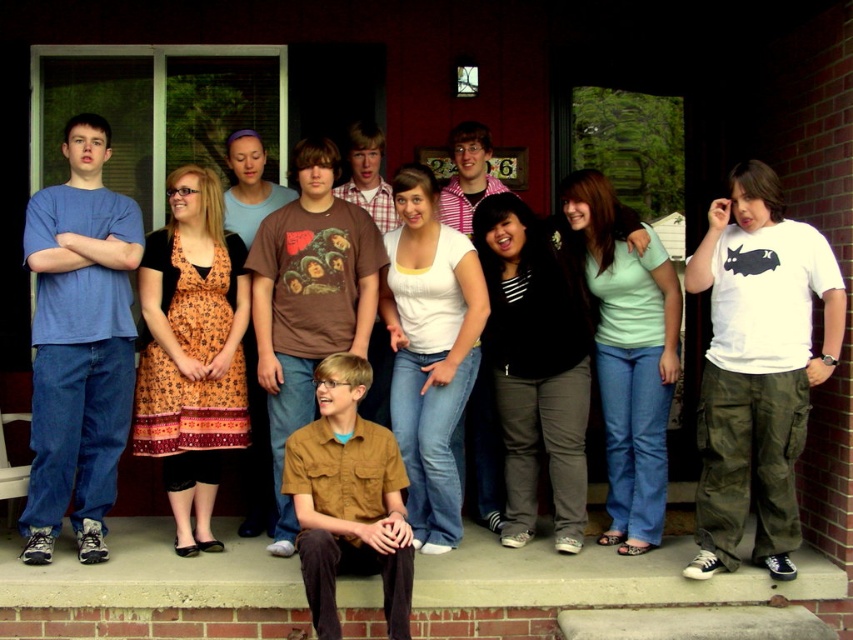
Question: Which object is positioned farthest from the matte blue t-shirt at left?

Choices:
 (A) brown cotton t-shirt at center
 (B) white matte t-shirt at center

Answer: (B)

Question: Which of the following is the closest to the observer?

Choices:
 (A) (827, 260)
 (B) (392, 564)
 (C) (271, 417)

Answer: (B)

Question: Among these objects, which one is farthest from the camera?

Choices:
 (A) matte blue t-shirt at left
 (B) white matte t-shirt at center

Answer: (A)

Question: Is matte blue t-shirt at left to the left of brown cotton t-shirt at center from the viewer's perspective?

Choices:
 (A) no
 (B) yes

Answer: (B)

Question: Is white matte t-shirt at center to the right of matte blue t-shirt at left from the viewer's perspective?

Choices:
 (A) no
 (B) yes

Answer: (B)

Question: Can you confirm if matte blue t-shirt at left is positioned to the right of brown cotton t-shirt at center?

Choices:
 (A) yes
 (B) no

Answer: (B)